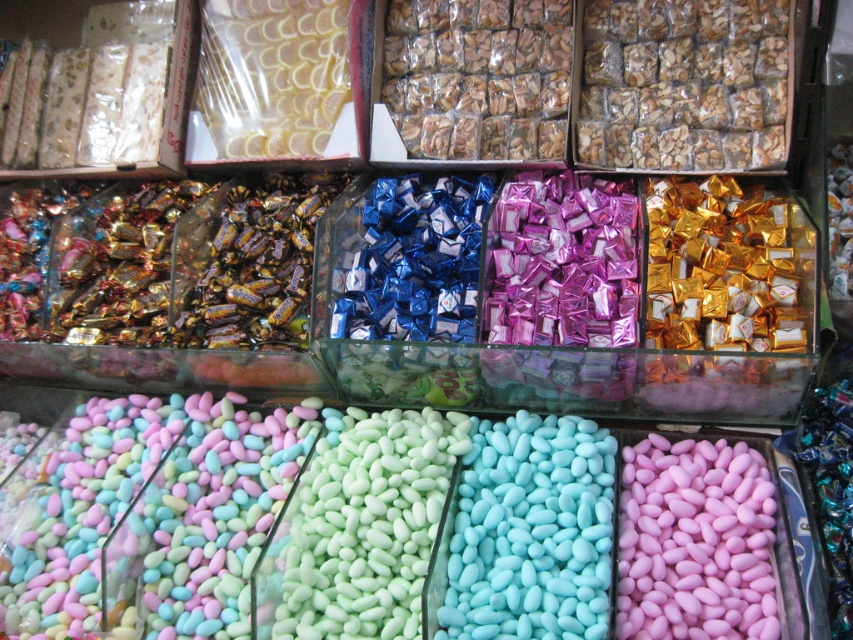
You are at a candy store and want to choose a candy that is taller between the blue matte candy at center and the pink matte candy at lower right. Which one should you pick?

The blue matte candy at center is taller than the pink matte candy at lower right, so you should pick the blue matte candy at center.

You are a customer at a candy store and want to buy the blue matte candy at center and the pink matte candy at lower right. If you look straight ahead, which candy is positioned higher?

The blue matte candy at center is located above the pink matte candy at lower right, so it is positioned higher when looking straight ahead.

You are a customer at a candy store and want to grab a blue matte candy at center and a pink matte candy at lower right. Which one do you need to reach over first?

The blue matte candy at center is in front of pink matte candy at lower right, so you would need to reach over the blue matte candy at center first to access the pink matte candy at lower right.